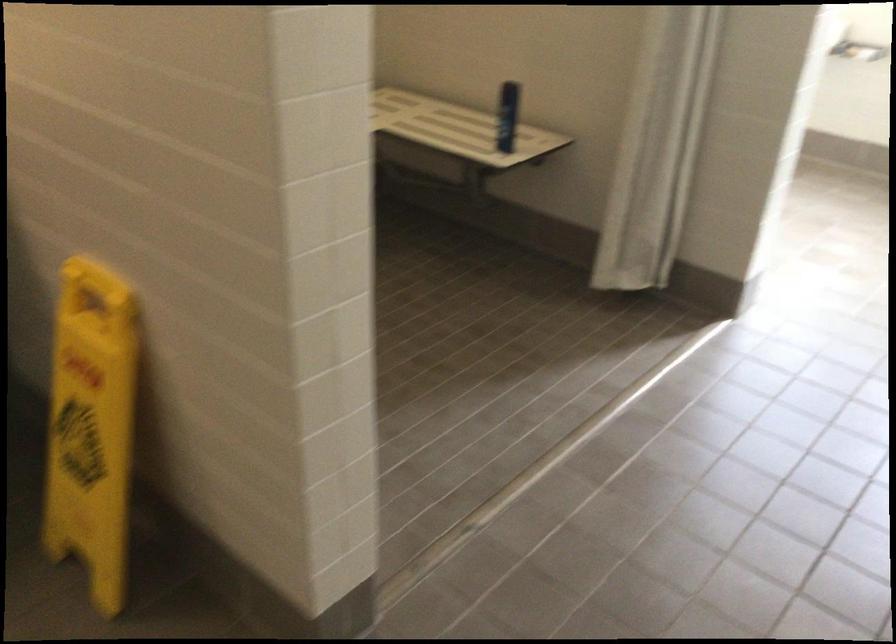
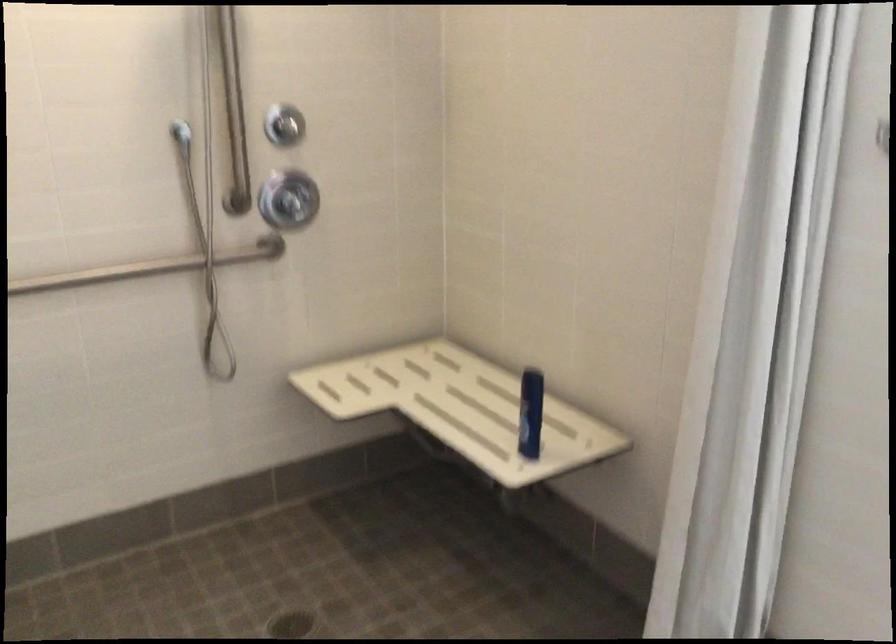
What movement of the cameraman would produce the second image?

The cameraman moved toward right, forward.